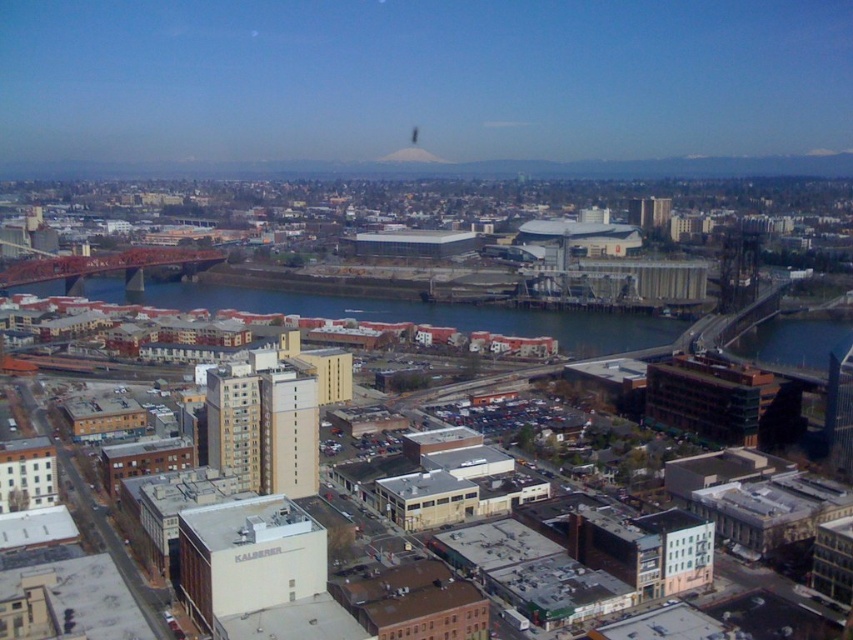
Is red painted steel bridge at left below white snow-covered mountain at upper center?

Yes.

Is red painted steel bridge at left bigger than white snow-covered mountain at upper center?

Indeed, red painted steel bridge at left has a larger size compared to white snow-covered mountain at upper center.

Identify the location of red painted steel bridge at left. coord(107,266).

Is blue water at center in front of smooth gray mountain at upper center?

Yes.

Looking at this image, does blue water at center appear on the left side of smooth gray mountain at upper center?

Indeed, blue water at center is positioned on the left side of smooth gray mountain at upper center.

This screenshot has height=640, width=853. What do you see at coordinates (421, 314) in the screenshot?
I see `blue water at center` at bounding box center [421, 314].

I want to click on blue water at center, so click(421, 314).

Does blue water at center have a greater height compared to red painted steel bridge at left?

Yes.

Does blue water at center appear on the left side of red painted steel bridge at left?

Incorrect, blue water at center is not on the left side of red painted steel bridge at left.

Which is behind, point (241, 301) or point (68, 282)?

Positioned behind is point (241, 301).

Identify the location of blue water at center. The height and width of the screenshot is (640, 853). (421, 314).